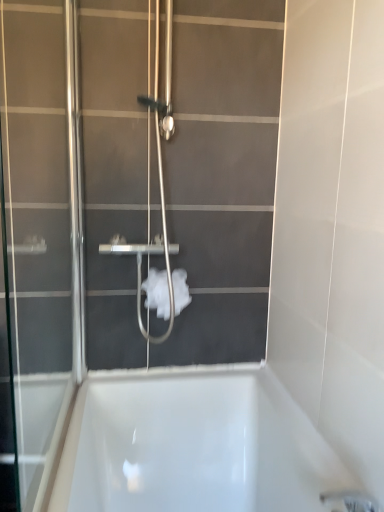
Question: From the image's perspective, relative to transparent glass screen door at left, is white fluffy toilet paper at center above or below?

Choices:
 (A) below
 (B) above

Answer: (A)

Question: Considering the relative positions of white fluffy toilet paper at center and transparent glass screen door at left in the image provided, is white fluffy toilet paper at center to the left or to the right of transparent glass screen door at left?

Choices:
 (A) left
 (B) right

Answer: (B)

Question: In the image, is white fluffy toilet paper at center positioned in front of or behind transparent glass screen door at left?

Choices:
 (A) front
 (B) behind

Answer: (B)

Question: Considering their positions, is transparent glass screen door at left located in front of or behind white fluffy toilet paper at center?

Choices:
 (A) behind
 (B) front

Answer: (B)

Question: From the image's perspective, is transparent glass screen door at left positioned above or below white fluffy toilet paper at center?

Choices:
 (A) below
 (B) above

Answer: (B)

Question: Looking at the image, does transparent glass screen door at left seem bigger or smaller compared to white fluffy toilet paper at center?

Choices:
 (A) big
 (B) small

Answer: (A)

Question: From a real-world perspective, is transparent glass screen door at left above or below white fluffy toilet paper at center?

Choices:
 (A) above
 (B) below

Answer: (A)